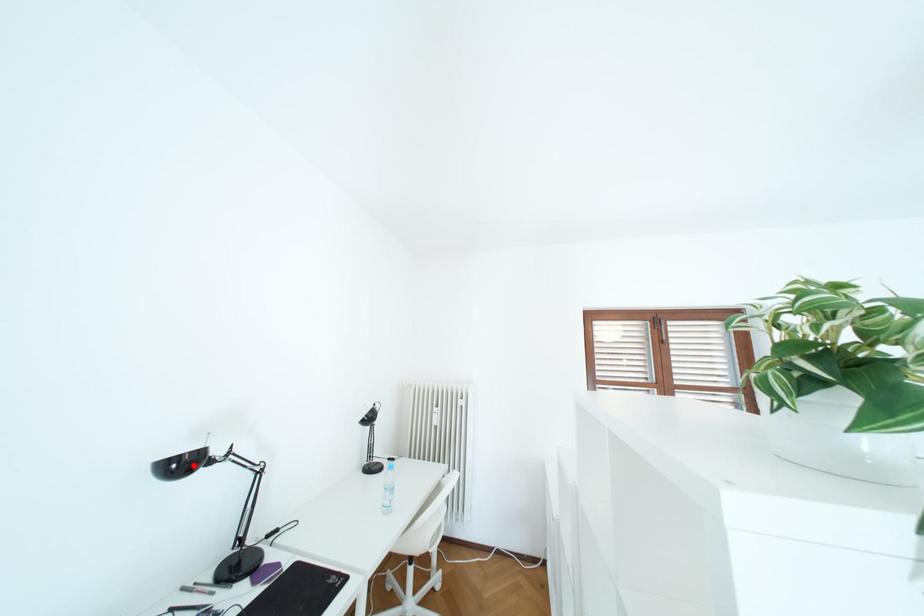
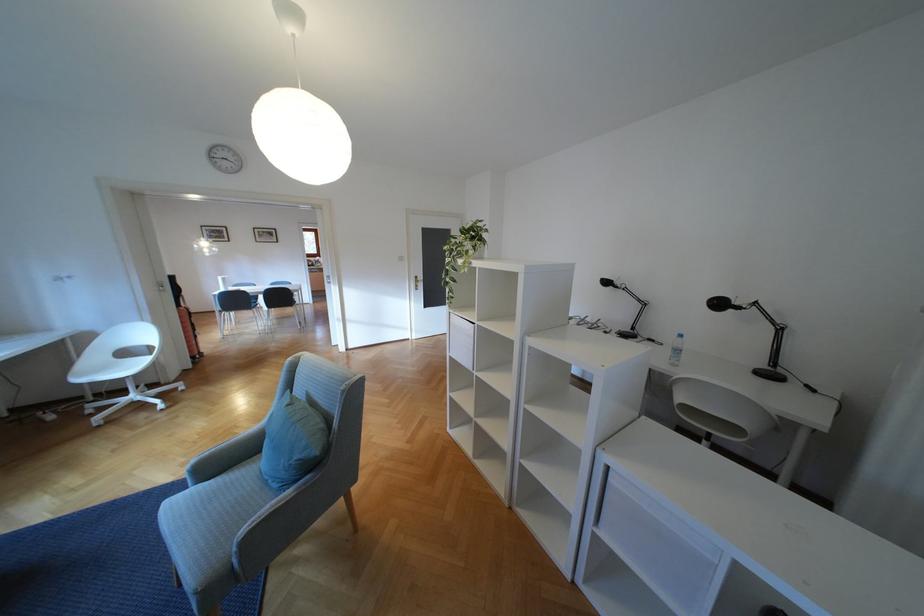
Locate, in the second image, the point that corresponds to the highlighted location in the first image.

(616, 284)